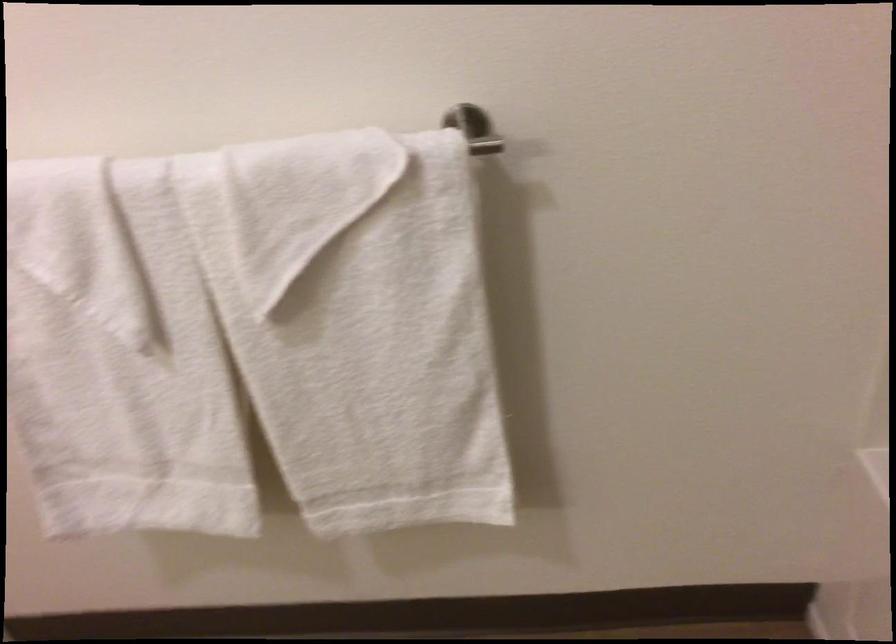
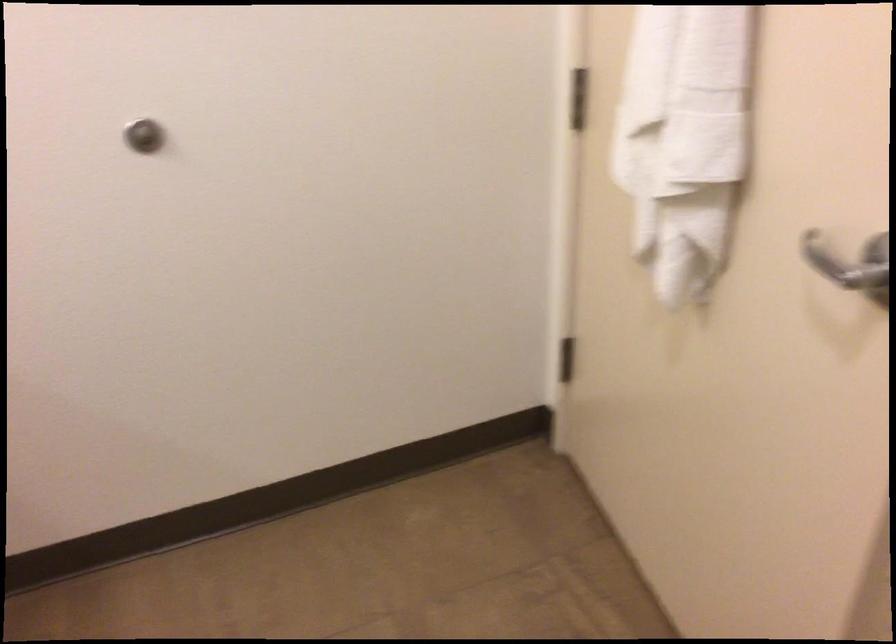
Based on the continuous images, in which direction is the camera rotating?

The camera rotated toward left-down.